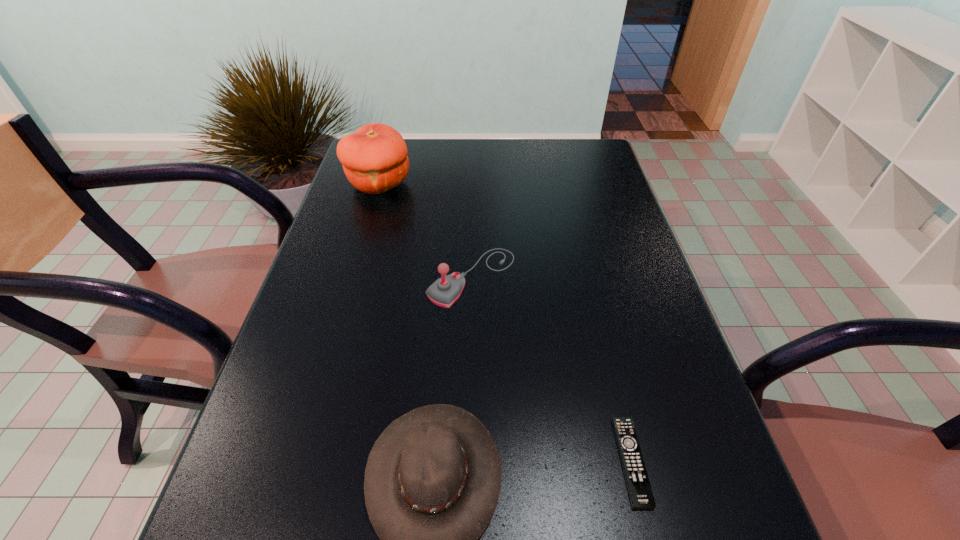
The image size is (960, 540). What are the coordinates of `blank region between the shortest object and the third nearest object` in the screenshot? It's located at (551, 369).

Identify the location of object that is the closest to the third nearest object. (374, 158).

Locate an element on the screen. object that is the third closest to the leftmost object is located at coordinates (640, 493).